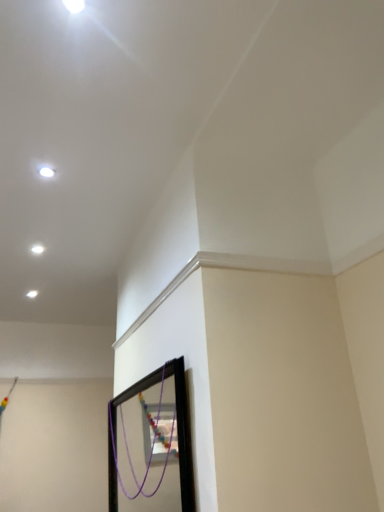
Question: Does white glossy light at upper left, the 1th light viewed from the top, have a larger size compared to white glossy light at upper left, which is counted as the first light, starting from the back?

Choices:
 (A) yes
 (B) no

Answer: (B)

Question: Is white glossy light at upper left, the 1th light viewed from the front, taller than white glossy light at upper left, the second light in the top-to-bottom sequence?

Choices:
 (A) no
 (B) yes

Answer: (A)

Question: Is white glossy light at upper left, the 1th light viewed from the front, turned away from white glossy light at upper left, which is counted as the first light, starting from the back?

Choices:
 (A) yes
 (B) no

Answer: (B)

Question: From a real-world perspective, is white glossy light at upper left, the 1th light viewed from the front, positioned under white glossy light at upper left, the second light in the top-to-bottom sequence, based on gravity?

Choices:
 (A) yes
 (B) no

Answer: (B)

Question: From the image's perspective, would you say white glossy light at upper left, the second light when ordered from bottom to top, is positioned over white glossy light at upper left, the second light positioned from the right?

Choices:
 (A) no
 (B) yes

Answer: (B)

Question: Can you confirm if white glossy light at upper left, the second light positioned from the left, is positioned to the right of white glossy light at upper left, the second light positioned from the front?

Choices:
 (A) no
 (B) yes

Answer: (B)

Question: Does white glossy light at upper left, the second light positioned from the front, have a smaller size compared to white glossy light at upper left, the 1th light viewed from the top?

Choices:
 (A) no
 (B) yes

Answer: (A)

Question: From the image's perspective, would you say white glossy light at upper left, the second light positioned from the front, is shown under white glossy light at upper left, the 1th light viewed from the front?

Choices:
 (A) no
 (B) yes

Answer: (B)

Question: Can you confirm if white glossy light at upper left, arranged as the first light when viewed from the left, is bigger than white glossy light at upper left, the second light when ordered from bottom to top?

Choices:
 (A) yes
 (B) no

Answer: (A)

Question: Is white glossy light at upper left, the second light positioned from the right, taller than white glossy light at upper left, the 1th light viewed from the front?

Choices:
 (A) yes
 (B) no

Answer: (A)

Question: Is white glossy light at upper left, the second light in the top-to-bottom sequence, to the left of white glossy light at upper left, the second light positioned from the left, from the viewer's perspective?

Choices:
 (A) no
 (B) yes

Answer: (B)

Question: From a real-world perspective, is white glossy light at upper left, the second light in the top-to-bottom sequence, physically below white glossy light at upper left, the second light positioned from the left?

Choices:
 (A) no
 (B) yes

Answer: (B)

Question: From a real-world perspective, is white glossy light at upper left, the 1th light ordered from the bottom, positioned above or below white glossy light at upper left, the first light viewed from the right?

Choices:
 (A) below
 (B) above

Answer: (A)